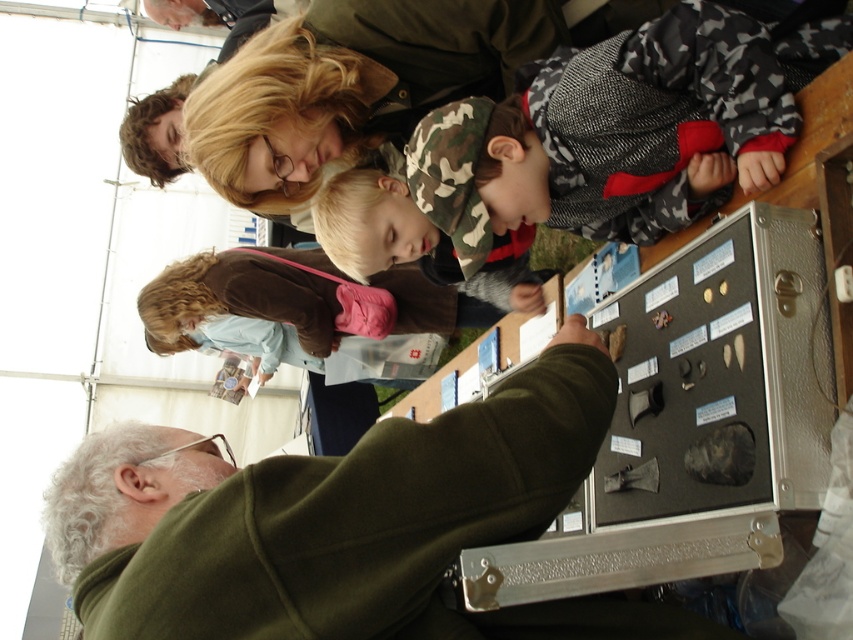
Does green matte jacket at center appear over brown suede purse at upper left?

No, green matte jacket at center is not above brown suede purse at upper left.

Is green matte jacket at center shorter than brown suede purse at upper left?

Indeed, green matte jacket at center has a lesser height compared to brown suede purse at upper left.

Identify the location of green matte jacket at center. (320, 512).

Where is `green matte jacket at center`? green matte jacket at center is located at coordinates (320, 512).